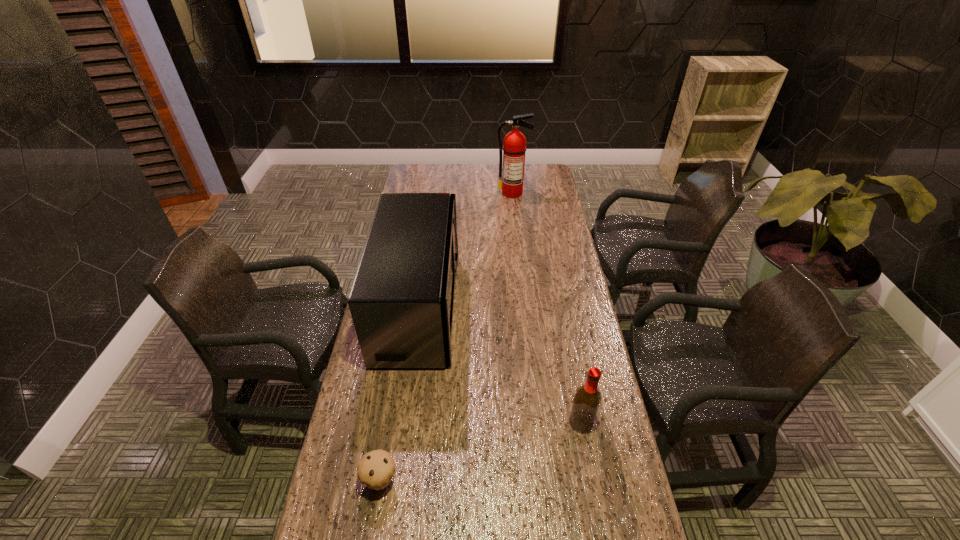
Identify the location of vacant area that lies between the third object from left to right and the microwave_oven. This screenshot has width=960, height=540. (466, 249).

Identify the location of free space between the farthest object and the beer bottle. Image resolution: width=960 pixels, height=540 pixels. (547, 308).

Where is `empty space between the muffin and the rightmost object`? empty space between the muffin and the rightmost object is located at coordinates (481, 451).

Where is `free space between the second nearest object and the third object from left to right`? free space between the second nearest object and the third object from left to right is located at coordinates (547, 308).

You are a GUI agent. You are given a task and a screenshot of the screen. Output one action in this format:
    pyautogui.click(x=<x>, y=<y>)
    Task: Click on the vacant space in between the second farthest object and the muffin
    The height and width of the screenshot is (540, 960).
    Given the screenshot: What is the action you would take?
    pyautogui.click(x=399, y=393)

The image size is (960, 540). Find the location of `unoccupied position between the microwave_oven and the rightmost object`. unoccupied position between the microwave_oven and the rightmost object is located at coordinates (500, 364).

The width and height of the screenshot is (960, 540). I want to click on object that is the third nearest to the rightmost object, so click(511, 182).

Point out which object is positioned as the nearest to the shortest object. Please provide its 2D coordinates. Your answer should be formatted as a tuple, i.e. [(x, y)], where the tuple contains the x and y coordinates of a point satisfying the conditions above.

[(402, 299)]

Where is `free spot that satisfies the following two spatial constraints: 1. on the front-facing side of the third tallest object; 2. on the right side of the third nearest object`? This screenshot has width=960, height=540. free spot that satisfies the following two spatial constraints: 1. on the front-facing side of the third tallest object; 2. on the right side of the third nearest object is located at coordinates (402, 423).

Where is `vacant space that satisfies the following two spatial constraints: 1. on the front-facing side of the rightmost object; 2. on the right side of the microwave_oven`? The height and width of the screenshot is (540, 960). vacant space that satisfies the following two spatial constraints: 1. on the front-facing side of the rightmost object; 2. on the right side of the microwave_oven is located at coordinates (402, 423).